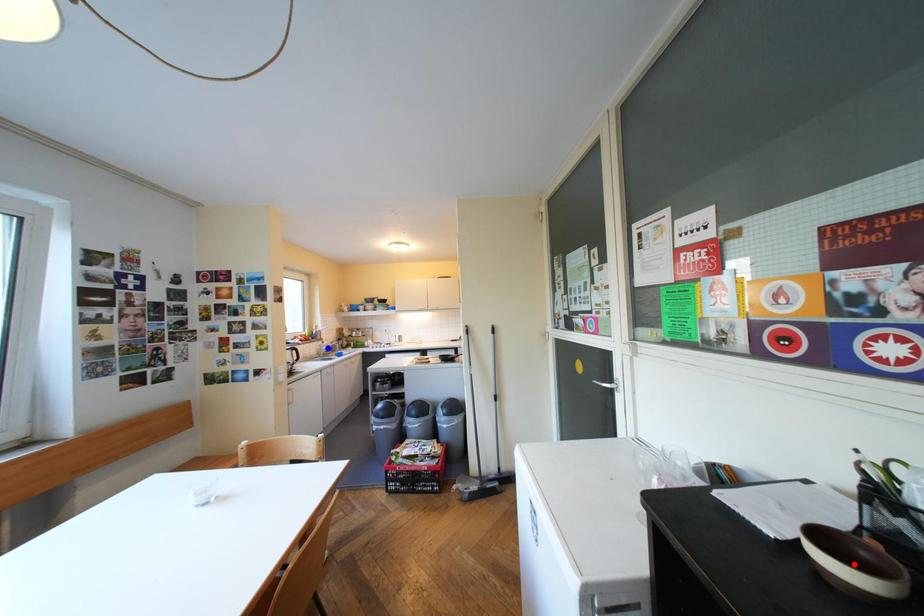
Question: Which of the two points in the image is closer to the camera?

Choices:
 (A) Blue point is closer.
 (B) Red point is closer.

Answer: (B)